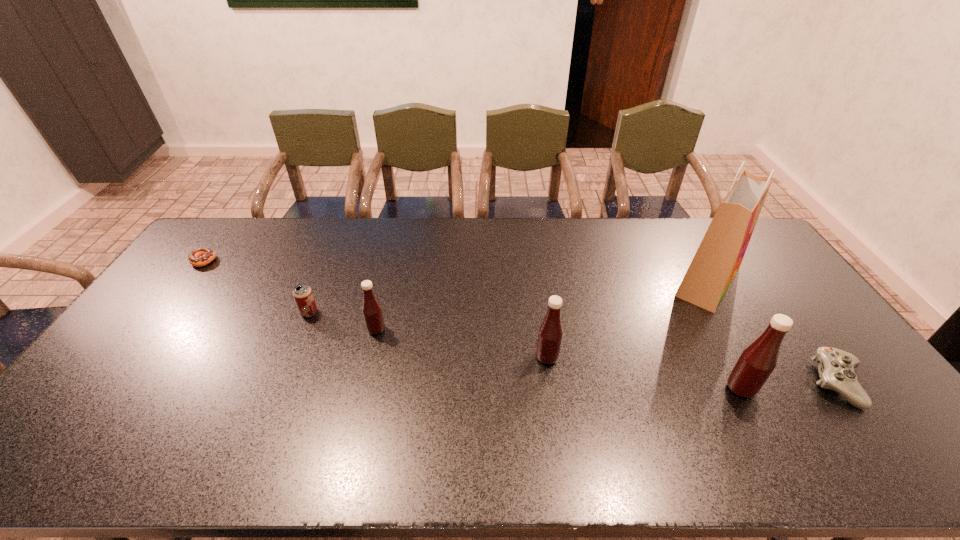
At what (x,y) coordinates should I click in order to perform the action: click on Tabasco sauce situated at the near edge. Please return your answer as a coordinate pair (x, y). Image resolution: width=960 pixels, height=540 pixels. Looking at the image, I should click on (756, 363).

The height and width of the screenshot is (540, 960). Find the location of `control located in the near edge section of the desktop`. control located in the near edge section of the desktop is located at coordinates (836, 369).

The height and width of the screenshot is (540, 960). Identify the location of object at the left edge. (201, 256).

Where is `shopping bag present at the right edge`? This screenshot has height=540, width=960. shopping bag present at the right edge is located at coordinates (719, 256).

Identify the location of control that is at the right edge. (836, 369).

Locate an element on the screen. Image resolution: width=960 pixels, height=540 pixels. object at the far left corner is located at coordinates (201, 256).

Where is `object at the far right corner`? This screenshot has height=540, width=960. object at the far right corner is located at coordinates (719, 256).

I want to click on object that is at the near right corner, so click(x=836, y=369).

Image resolution: width=960 pixels, height=540 pixels. I want to click on vacant space at the far edge of the desktop, so click(275, 241).

This screenshot has width=960, height=540. In the image, there is a desktop. What are the coordinates of `blank space at the near edge` in the screenshot? It's located at (773, 413).